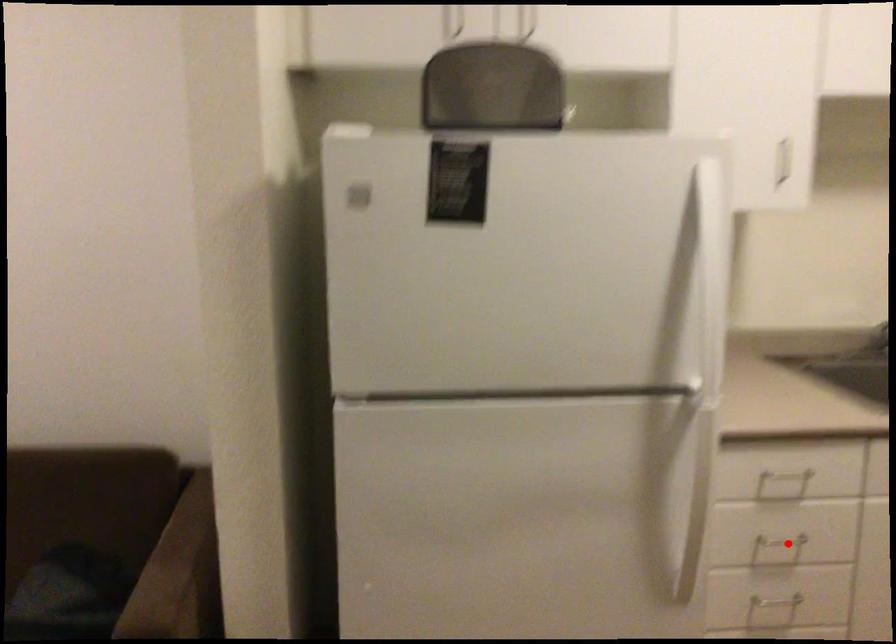
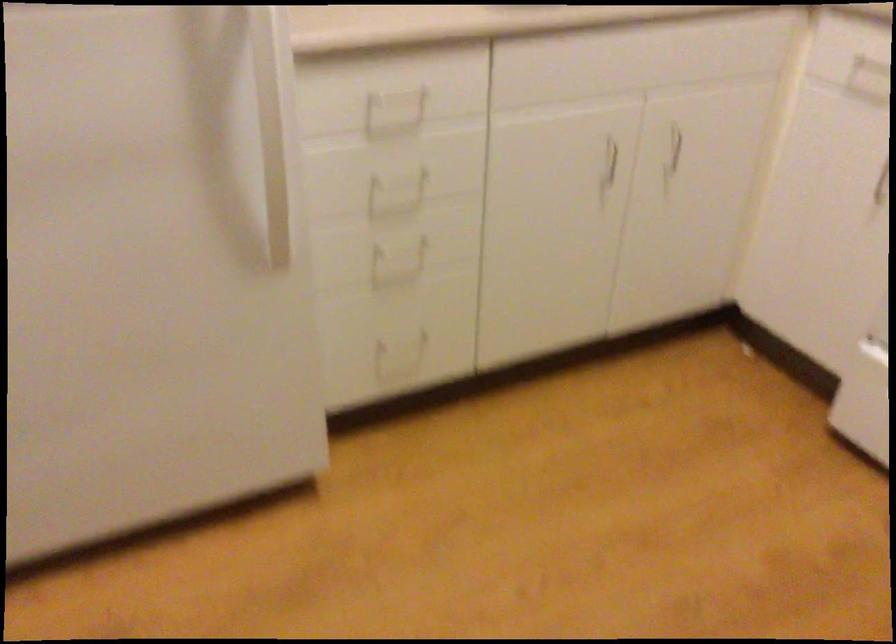
Question: I am providing you with two images of the same scene from different viewpoints. In image1, a red point is highlighted. Considering the same 3D point in image2, which of the following is correct?

Choices:
 (A) It is closer
 (B) It is farther

Answer: (A)